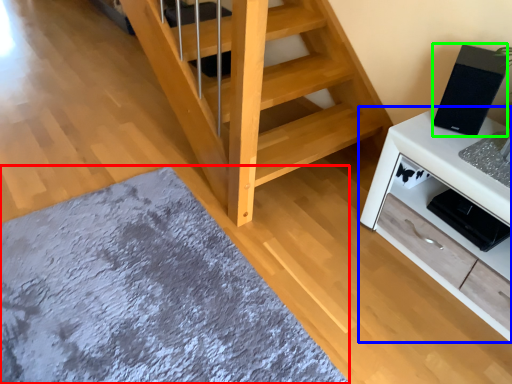
Question: Which object is the closest to the mat (highlighted by a red box)? Choose among these: cabinetry (highlighted by a blue box) or appliance (highlighted by a green box).

Choices:
 (A) cabinetry
 (B) appliance

Answer: (A)